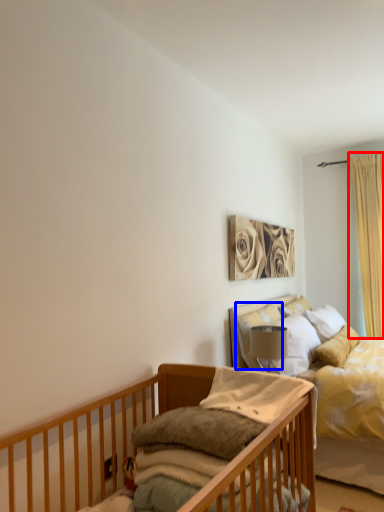
Question: Which of the following is the farthest to the observer, curtain (highlighted by a red box) or pillow (highlighted by a blue box)?

Choices:
 (A) curtain
 (B) pillow

Answer: (A)